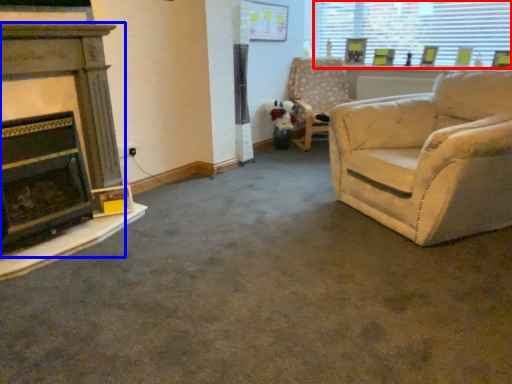
Question: Which object is further to the camera taking this photo, window (highlighted by a red box) or fireplace (highlighted by a blue box)?

Choices:
 (A) window
 (B) fireplace

Answer: (A)